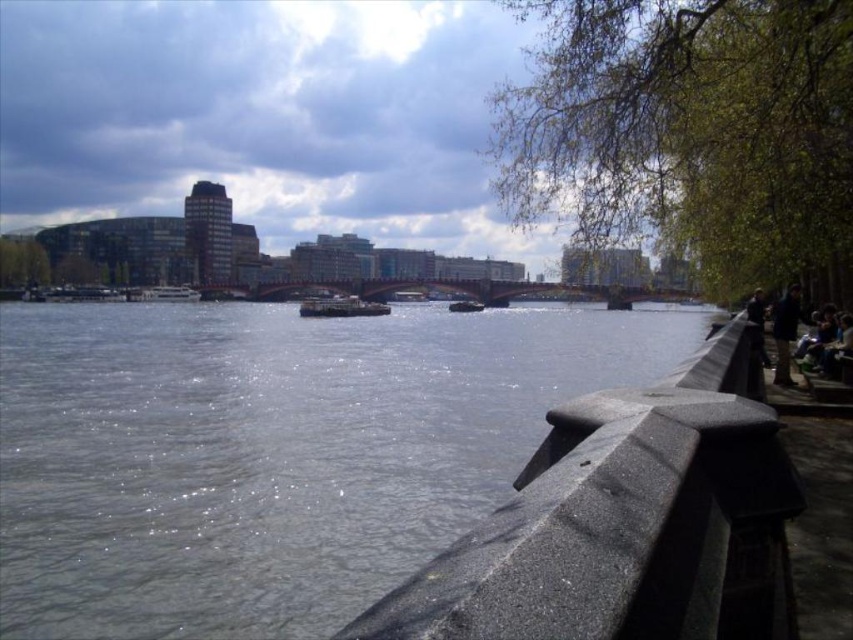
Question: Which point is farther from the camera taking this photo?

Choices:
 (A) 701,496
 (B) 753,308
 (C) 788,312

Answer: (B)

Question: Among these points, which one is nearest to the camera?

Choices:
 (A) (376, 624)
 (B) (756, 308)

Answer: (A)

Question: Does gray concrete rail at lower right lie in front of dark blue jacket at right?

Choices:
 (A) no
 (B) yes

Answer: (B)

Question: Can you confirm if gray concrete river at center is wider than gray concrete rail at lower right?

Choices:
 (A) no
 (B) yes

Answer: (B)

Question: Based on their relative distances, which object is farther from the gray concrete river at center?

Choices:
 (A) gray concrete rail at lower right
 (B) dark blue jacket at right
 (C) dark gray fabric jacket at right

Answer: (C)

Question: Does gray concrete rail at lower right appear on the right side of dark blue jacket at right?

Choices:
 (A) no
 (B) yes

Answer: (A)